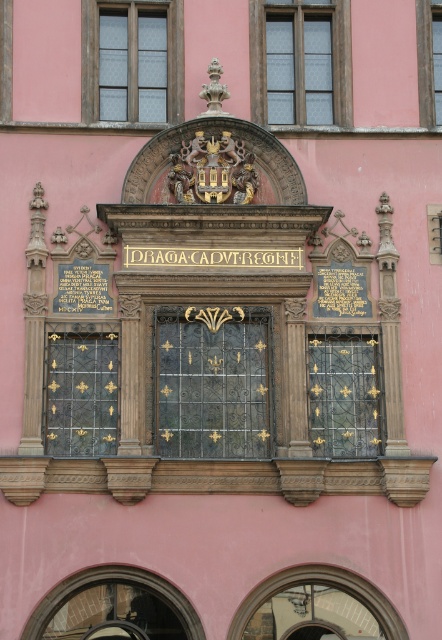
Question: Is clear glass window at upper left below polished brass grille at center left?

Choices:
 (A) yes
 (B) no

Answer: (B)

Question: Among these points, which one is farthest from the camera?

Choices:
 (A) (76, 362)
 (B) (138, 67)
 (C) (425, 106)
 (D) (265, 122)

Answer: (B)

Question: Where is black wrought iron window at center located in relation to clear glass window at upper right in the image?

Choices:
 (A) left
 (B) right

Answer: (A)

Question: Does clear glass window at upper center appear over black wrought iron window at center?

Choices:
 (A) yes
 (B) no

Answer: (A)

Question: Which object is farther from the camera taking this photo?

Choices:
 (A) clear glass window at upper center
 (B) black wrought iron window at center

Answer: (A)

Question: Estimate the real-world distances between objects in this image. Which object is closer to the clear glass window at upper center?

Choices:
 (A) clear glass window at upper left
 (B) polished brass grille at center left
 (C) black wrought iron window at center

Answer: (A)